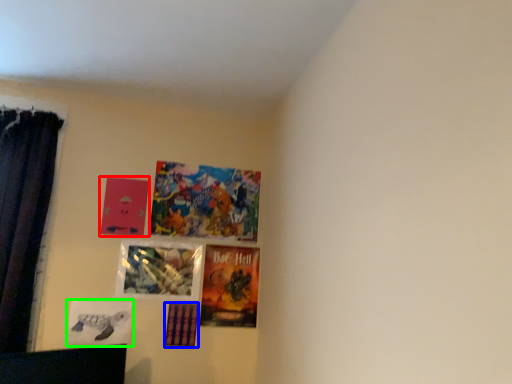
Question: Based on their relative distances, which object is farther from picture frame (highlighted by a red box)? Choose from picture frame (highlighted by a blue box) and picture frame (highlighted by a green box).

Choices:
 (A) picture frame
 (B) picture frame

Answer: (A)